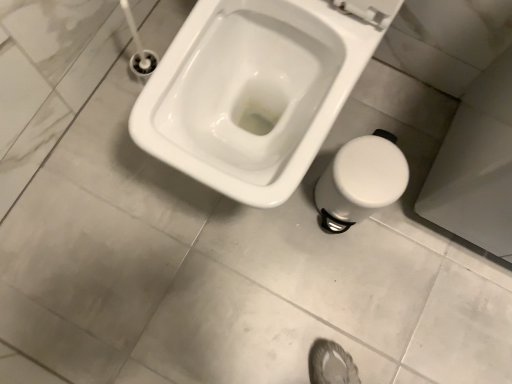
Question: From the image's perspective, is white glossy toilet at center on white plastic bidet at lower right?

Choices:
 (A) no
 (B) yes

Answer: (B)

Question: Is white glossy toilet at center turned away from white plastic bidet at lower right?

Choices:
 (A) no
 (B) yes

Answer: (A)

Question: Is white glossy toilet at center thinner than white plastic bidet at lower right?

Choices:
 (A) no
 (B) yes

Answer: (A)

Question: Does white glossy toilet at center come in front of white plastic bidet at lower right?

Choices:
 (A) yes
 (B) no

Answer: (A)

Question: From a real-world perspective, is white glossy toilet at center located beneath white plastic bidet at lower right?

Choices:
 (A) yes
 (B) no

Answer: (B)

Question: Does white glossy toilet at center have a greater height compared to white plastic bidet at lower right?

Choices:
 (A) yes
 (B) no

Answer: (A)

Question: Is white plastic bidet at lower right shorter than white glossy toilet at center?

Choices:
 (A) no
 (B) yes

Answer: (B)

Question: From the image's perspective, is white plastic bidet at lower right beneath white glossy toilet at center?

Choices:
 (A) no
 (B) yes

Answer: (B)

Question: Considering the relative sizes of white plastic bidet at lower right and white glossy toilet at center in the image provided, is white plastic bidet at lower right taller than white glossy toilet at center?

Choices:
 (A) no
 (B) yes

Answer: (A)

Question: Does white plastic bidet at lower right appear on the left side of white glossy toilet at center?

Choices:
 (A) yes
 (B) no

Answer: (B)

Question: Is white plastic bidet at lower right located outside white glossy toilet at center?

Choices:
 (A) yes
 (B) no

Answer: (A)

Question: Can you confirm if white plastic bidet at lower right is smaller than white glossy toilet at center?

Choices:
 (A) yes
 (B) no

Answer: (A)

Question: Is white glossy toilet at center wider or thinner than white plastic bidet at lower right?

Choices:
 (A) wide
 (B) thin

Answer: (A)